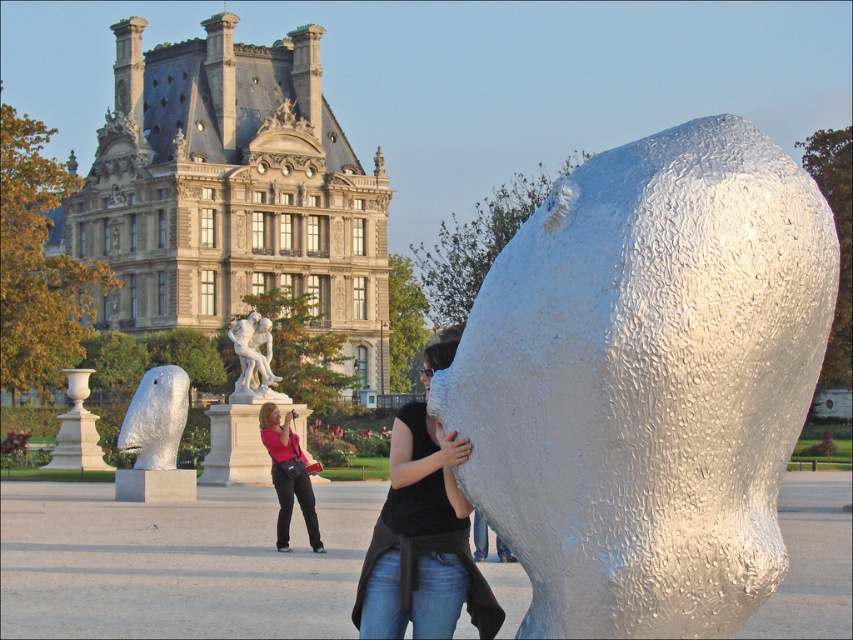
Does matte black shirt at center appear under silver textured head at left?

Yes, matte black shirt at center is below silver textured head at left.

Which is above, matte black shirt at center or silver textured head at left?

Positioned higher is silver textured head at left.

This screenshot has width=853, height=640. What are the coordinates of `matte black shirt at center` in the screenshot? It's located at (422, 541).

Is silver textured head at left to the left of matte pink shirt at center from the viewer's perspective?

Indeed, silver textured head at left is positioned on the left side of matte pink shirt at center.

Who is more distant from viewer, (163,371) or (310,520)?

The point (163,371) is behind.

Who is more distant from viewer, (132, 419) or (276, 426)?

The point (132, 419) is behind.

Locate an element on the screen. silver textured head at left is located at coordinates (155, 419).

Can you confirm if metallic textured head at center is positioned below silver textured head at left?

Indeed, metallic textured head at center is positioned under silver textured head at left.

Is metallic textured head at center further to camera compared to silver textured head at left?

No, it is in front of silver textured head at left.

Find the location of a particular element. metallic textured head at center is located at coordinates (647, 381).